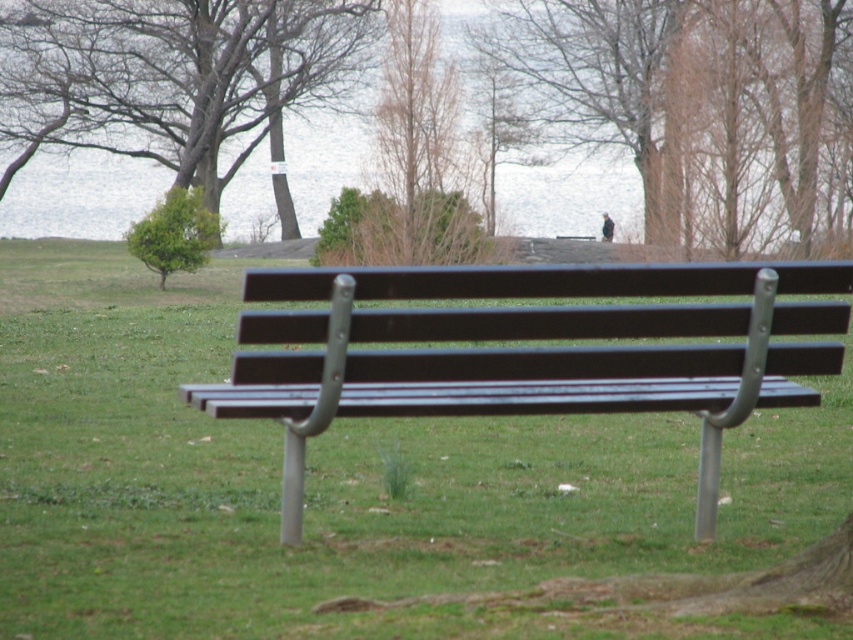
Based on the scene described, which tree, the brown wood tree at upper center or the green leafy tree at upper left, has a larger width?

The brown wood tree at upper center might be wider than the green leafy tree at upper left according to the description.

Based on the photo, you are planning to take a photo of the park bench in the scene. Which tree, the brown wood tree at upper center or the green leafy tree at upper left, would make a better backdrop to frame the bench?

The brown wood tree at upper center would make a better backdrop because it is bigger than the green leafy tree at upper left, providing a more prominent and balanced frame for the bench.